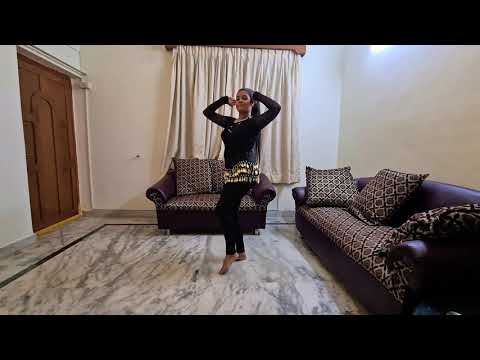
This screenshot has width=480, height=360. Find the location of `light fixture`. light fixture is located at coordinates (382, 47).